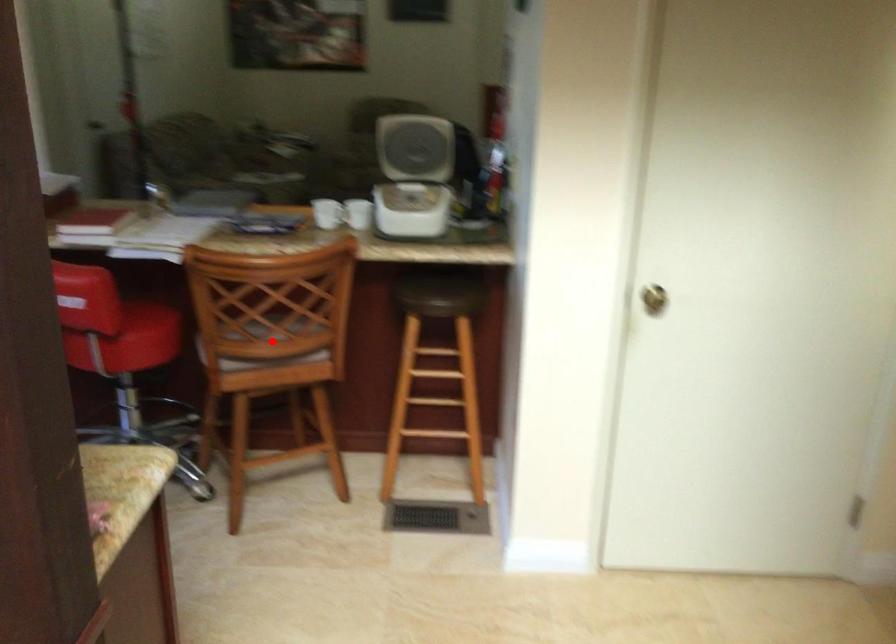
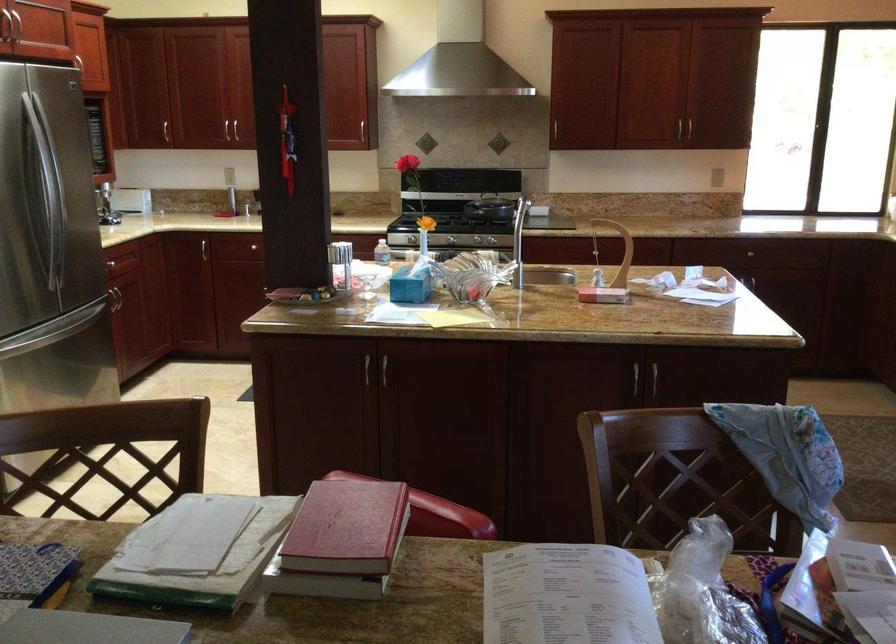
Question: I am providing you with two images of the same scene from different viewpoints. A red point is marked on the first image. Is the red point's position out of view in image 2?

Choices:
 (A) Yes
 (B) No

Answer: (A)